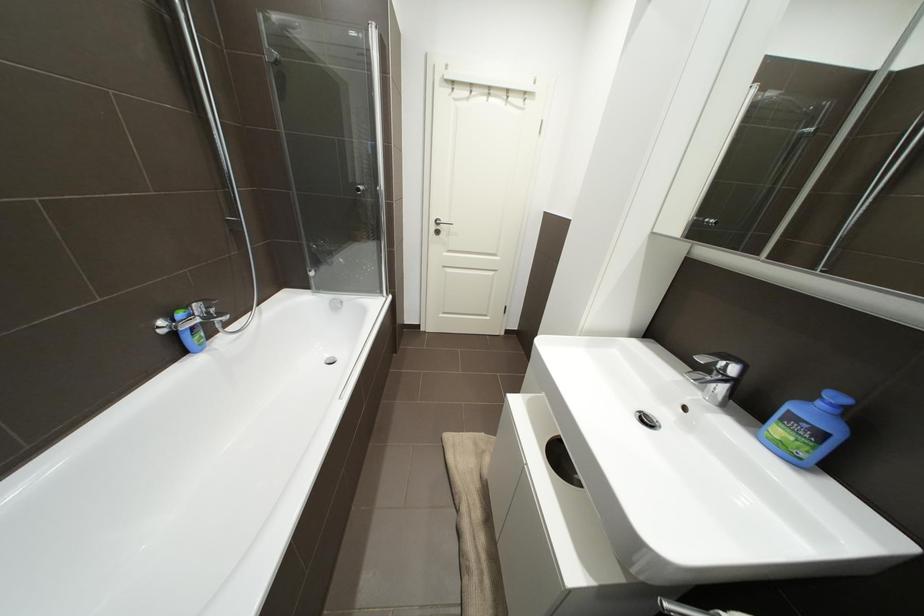
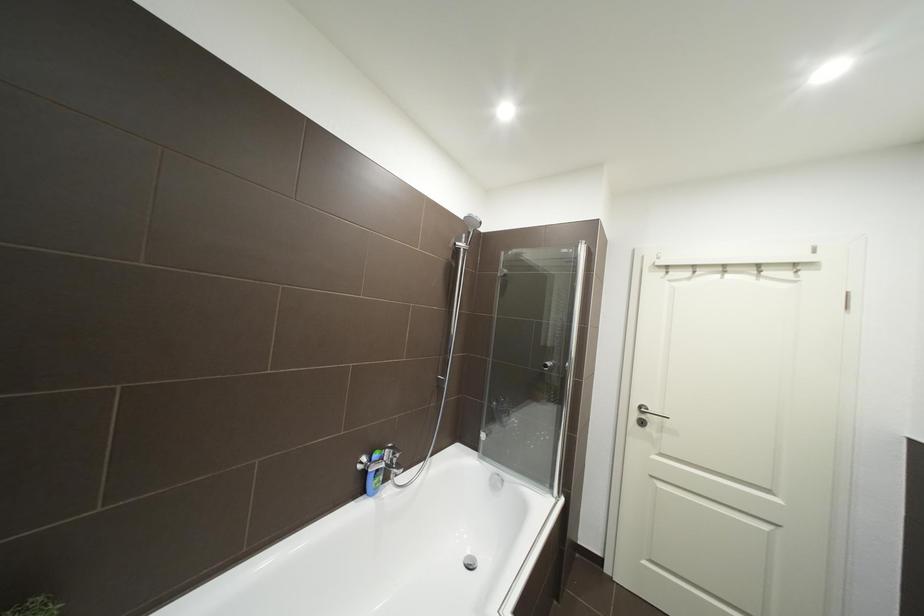
Based on the continuous images, in which direction is the camera rotating?

The rotation direction of the camera is left-up.